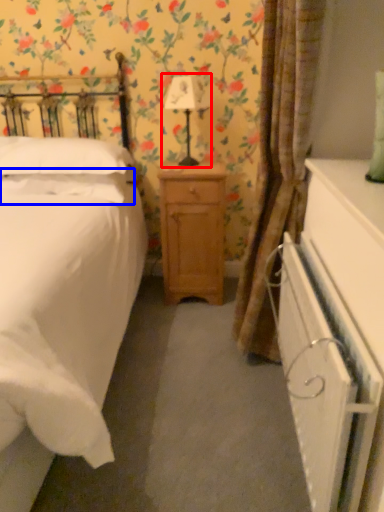
Question: Which of the following is the farthest to the observer, bedside lamp (highlighted by a red box) or pillow (highlighted by a blue box)?

Choices:
 (A) bedside lamp
 (B) pillow

Answer: (B)